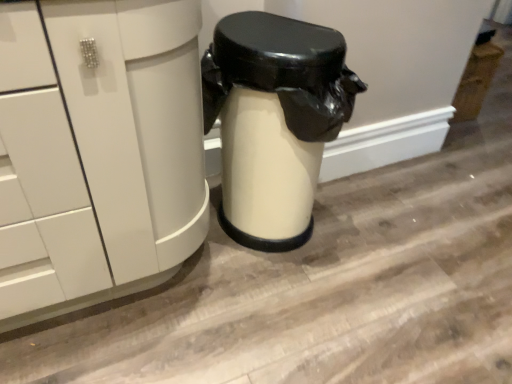
What do you see at coordinates (97, 152) in the screenshot? I see `white glossy cabinet at left` at bounding box center [97, 152].

In order to face white glossy cabinet at left, should I rotate leftwards or rightwards?

To face it directly, rotate left by 22.448 degrees.

This screenshot has width=512, height=384. I want to click on white glossy cabinet at left, so click(x=97, y=152).

This screenshot has width=512, height=384. What are the coordinates of `white glossy trash can at center` in the screenshot? It's located at (274, 119).

The height and width of the screenshot is (384, 512). Describe the element at coordinates (274, 119) in the screenshot. I see `white glossy trash can at center` at that location.

The width and height of the screenshot is (512, 384). I want to click on white glossy cabinet at left, so click(x=97, y=152).

Does white glossy cabinet at left appear on the left side of white glossy trash can at center?

Indeed, white glossy cabinet at left is positioned on the left side of white glossy trash can at center.

Is white glossy cabinet at left positioned behind white glossy trash can at center?

No, it is not.

Is point (12, 113) farther from viewer compared to point (257, 201)?

No, it is not.

From the image's perspective, which is above, white glossy cabinet at left or white glossy trash can at center?

From the image's view, white glossy trash can at center is above.

From a real-world perspective, is white glossy cabinet at left physically located above or below white glossy trash can at center?

white glossy cabinet at left is situated higher than white glossy trash can at center in the real world.

Can you confirm if white glossy cabinet at left is thinner than white glossy trash can at center?

No.

Is white glossy cabinet at left shorter than white glossy trash can at center?

In fact, white glossy cabinet at left may be taller than white glossy trash can at center.

Does white glossy cabinet at left have a smaller size compared to white glossy trash can at center?

No.

Looking at this image, is white glossy trash can at center located within white glossy cabinet at left?

No, white glossy trash can at center is not a part of white glossy cabinet at left.

Is white glossy cabinet at left far away from white glossy trash can at center?

No, white glossy cabinet at left is not far away from white glossy trash can at center.

Is white glossy trash can at center at the back of white glossy cabinet at left?

No, white glossy cabinet at left is not facing away from white glossy trash can at center.

How many degrees apart are the facing directions of white glossy cabinet at left and white glossy trash can at center?

1.61 degrees.

Measure the distance from white glossy cabinet at left to white glossy trash can at center.

A distance of 12.85 inches exists between white glossy cabinet at left and white glossy trash can at center.

The image size is (512, 384). Find the location of `cabinetry below the white glossy trash can at center (from the image's perspective)`. cabinetry below the white glossy trash can at center (from the image's perspective) is located at coordinates (97, 152).

Is white glossy trash can at center to the right of white glossy cabinet at left from the viewer's perspective?

Indeed, white glossy trash can at center is positioned on the right side of white glossy cabinet at left.

Which is behind, white glossy trash can at center or white glossy cabinet at left?

white glossy trash can at center.

Is point (304, 165) more distant than point (130, 125)?

That is True.

From the image's perspective, is white glossy trash can at center on white glossy cabinet at left?

Yes, from the image's perspective, white glossy trash can at center is over white glossy cabinet at left.

From a real-world perspective, is white glossy trash can at center positioned over white glossy cabinet at left based on gravity?

No, from a real-world perspective, white glossy trash can at center is not above white glossy cabinet at left.

Is white glossy trash can at center thinner than white glossy cabinet at left?

Indeed, white glossy trash can at center has a lesser width compared to white glossy cabinet at left.

Does white glossy trash can at center have a greater height compared to white glossy cabinet at left?

Incorrect, the height of white glossy trash can at center is not larger of that of white glossy cabinet at left.

Considering the relative sizes of white glossy trash can at center and white glossy cabinet at left in the image provided, is white glossy trash can at center smaller than white glossy cabinet at left?

Yes, white glossy trash can at center is smaller than white glossy cabinet at left.

Is white glossy cabinet at left completely or partially inside white glossy trash can at center?

No, white glossy cabinet at left is located outside of white glossy trash can at center.

Is white glossy trash can at center in contact with white glossy cabinet at left?

No.

Is white glossy cabinet at left at the back of white glossy trash can at center?

No, white glossy cabinet at left is not at the back of white glossy trash can at center.

Can you tell me how much white glossy trash can at center and white glossy cabinet at left differ in facing direction?

1.61 degrees separate the facing orientations of white glossy trash can at center and white glossy cabinet at left.

How distant is white glossy trash can at center from white glossy cabinet at left?

The distance of white glossy trash can at center from white glossy cabinet at left is 32.63 centimeters.

At what (x,y) coordinates should I click in order to perform the action: click on cabinetry lying in front of the white glossy trash can at center. Please return your answer as a coordinate pair (x, y). Looking at the image, I should click on (97, 152).

Find the location of a particular element. This screenshot has width=512, height=384. garbage below the white glossy cabinet at left (from a real-world perspective) is located at coordinates (274, 119).

Where is `garbage on the right of white glossy cabinet at left`? This screenshot has width=512, height=384. garbage on the right of white glossy cabinet at left is located at coordinates (274, 119).